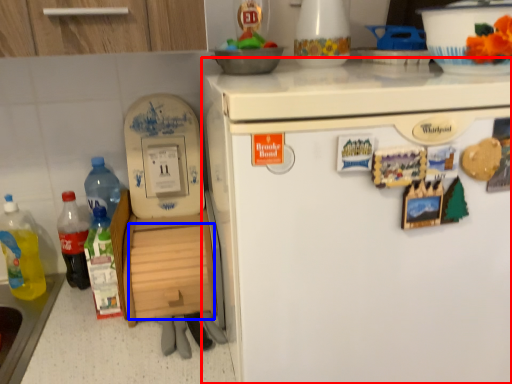
Question: Which object appears farthest to the camera in this image, refrigerator (highlighted by a red box) or drawer (highlighted by a blue box)?

Choices:
 (A) refrigerator
 (B) drawer

Answer: (B)